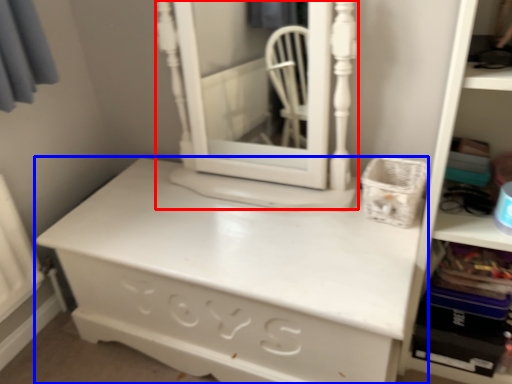
Question: Among these objects, which one is farthest to the camera, medicine cabinet (highlighted by a red box) or chest of drawers (highlighted by a blue box)?

Choices:
 (A) medicine cabinet
 (B) chest of drawers

Answer: (A)